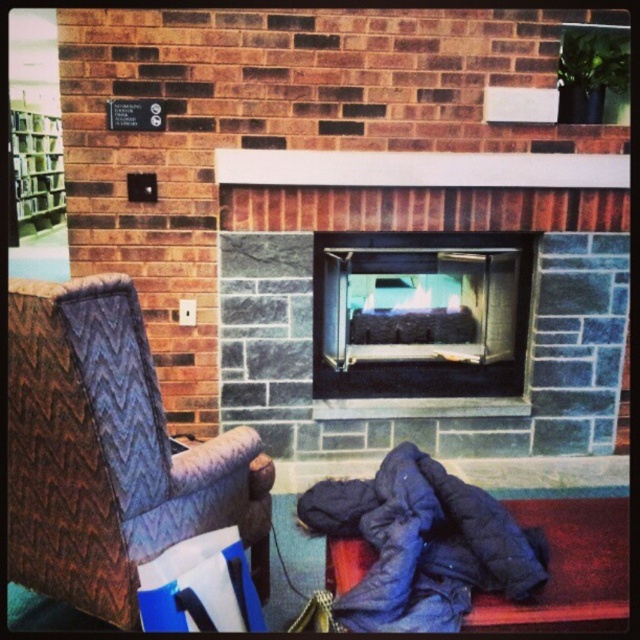
Consider the image. Does gray stone fireplace at center appear on the right side of green matte bookshelf at upper left?

Correct, you'll find gray stone fireplace at center to the right of green matte bookshelf at upper left.

In the scene shown: Who is positioned more to the left, gray stone fireplace at center or green matte bookshelf at upper left?

Positioned to the left is green matte bookshelf at upper left.

You are a GUI agent. You are given a task and a screenshot of the screen. Output one action in this format:
    pyautogui.click(x=<x>, y=<y>)
    Task: Click on the gray stone fireplace at center
    The width and height of the screenshot is (640, 640).
    Given the screenshot: What is the action you would take?
    pyautogui.click(x=426, y=397)

Identify the location of gray stone fireplace at center. (426, 397).

Between point (362, 240) and point (454, 518), which one is positioned in front?

Point (454, 518) is more forward.

Consider the image. Does matte glass fireplace at center have a lesser height compared to dark blue quilted sleeping bag at lower right?

Incorrect, matte glass fireplace at center's height does not fall short of dark blue quilted sleeping bag at lower right's.

Locate an element on the screen. This screenshot has width=640, height=640. matte glass fireplace at center is located at coordinates (420, 323).

The height and width of the screenshot is (640, 640). Identify the location of matte glass fireplace at center. (420, 323).

Which is below, gray stone fireplace at center or brown quilted fabric armchair at left?

Positioned lower is brown quilted fabric armchair at left.

Does gray stone fireplace at center come behind brown quilted fabric armchair at left?

Yes.

Does point (292, 148) come closer to viewer compared to point (74, 579)?

That is False.

Where is `gray stone fireplace at center`? The width and height of the screenshot is (640, 640). gray stone fireplace at center is located at coordinates (426, 397).